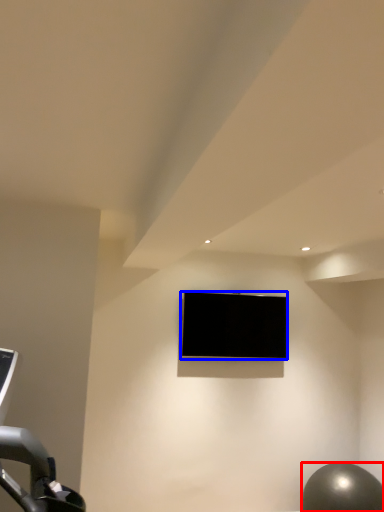
Question: Among these objects, which one is nearest to the camera, ball (highlighted by a red box) or television (highlighted by a blue box)?

Choices:
 (A) ball
 (B) television

Answer: (A)